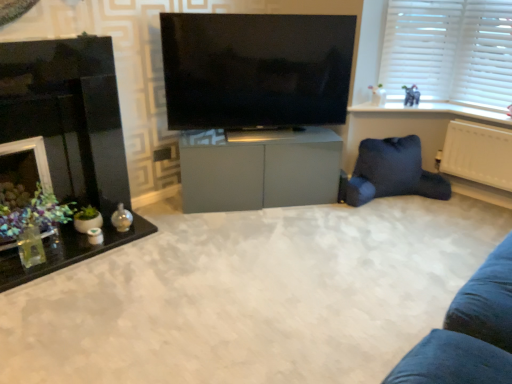
Locate an element on the screen. free area in between matte gray cabinet at center and translucent glass table at left is located at coordinates (196, 230).